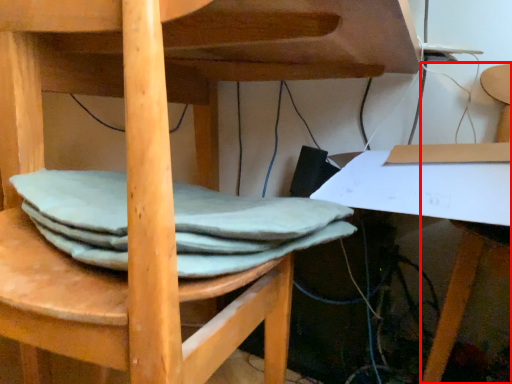
Question: Where is chair (annotated by the red box) located in relation to fabric in the image?

Choices:
 (A) left
 (B) right

Answer: (B)